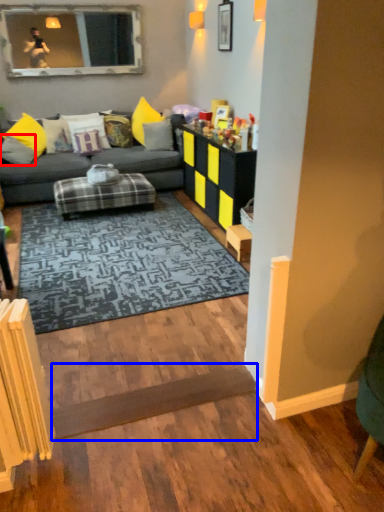
Question: Which point is further to the camera, pillow (highlighted by a red box) or plank (highlighted by a blue box)?

Choices:
 (A) pillow
 (B) plank

Answer: (A)